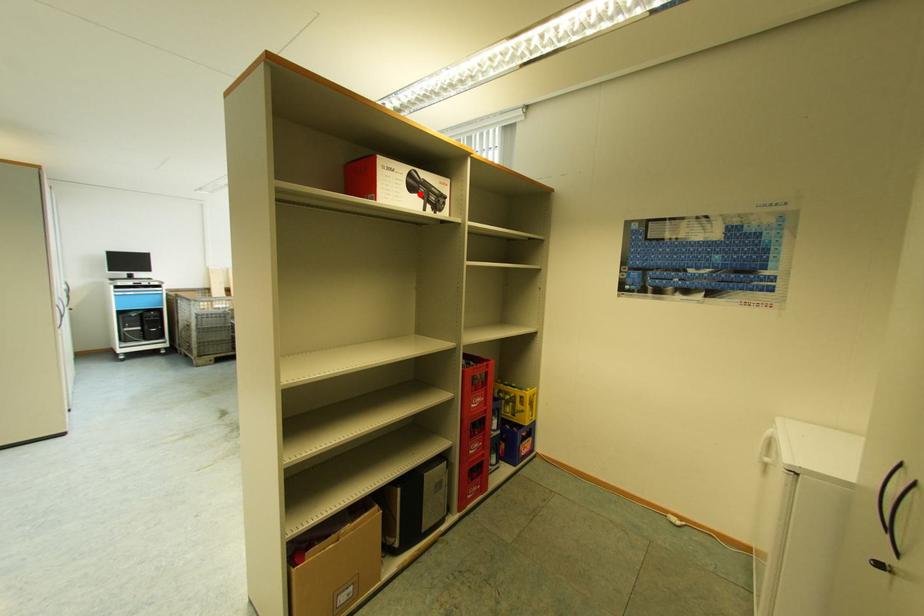
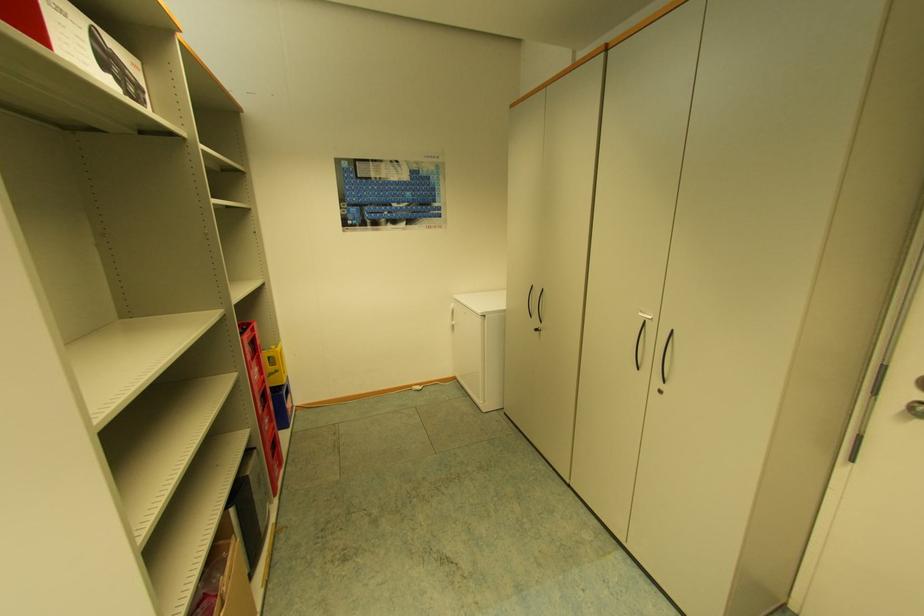
The point at the highlighted location is marked in the first image. Where is the corresponding point in the second image?

(115, 78)